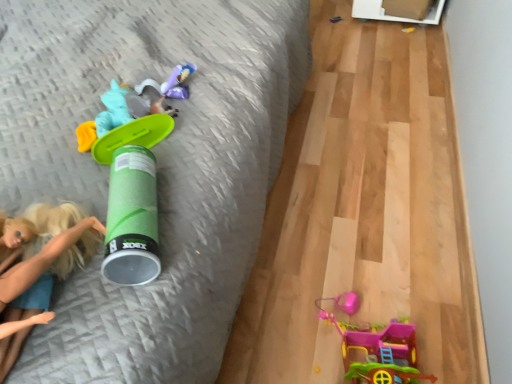
Find the location of a particular element. The height and width of the screenshot is (384, 512). vacant region above green plastic bed frame at left (from a real-world perspective) is located at coordinates (335, 163).